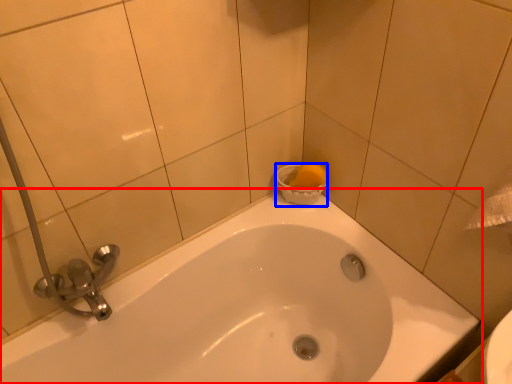
Question: Which object appears farthest to the camera in this image, bathtub (highlighted by a red box) or basin (highlighted by a blue box)?

Choices:
 (A) bathtub
 (B) basin

Answer: (B)